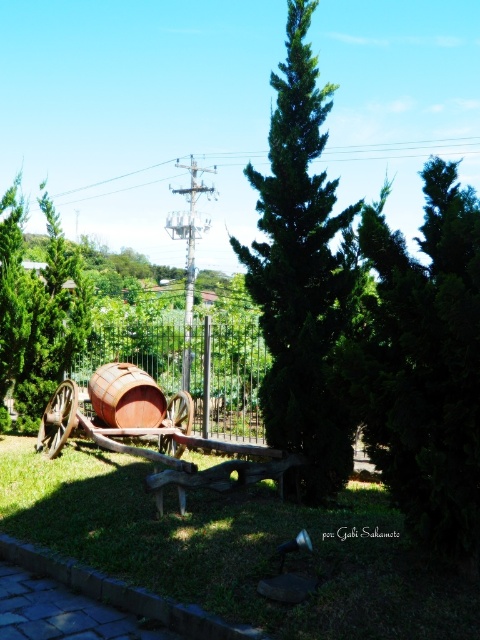
Is dark green textured tree at center above green leafy tree at center?

No.

Does dark green textured tree at center have a smaller size compared to green leafy tree at center?

Yes.

Where is `dark green textured tree at center`? The height and width of the screenshot is (640, 480). dark green textured tree at center is located at coordinates (423, 364).

Is green grass at center bigger than green leafy tree at left?

No.

Who is more distant from viewer, (367, 618) or (9, 301)?

Point (9, 301)

Image resolution: width=480 pixels, height=640 pixels. I want to click on green grass at center, so click(238, 547).

How much distance is there between green leafy tree at left and metallic wire at upper center?

Result: A distance of 5.84 meters exists between green leafy tree at left and metallic wire at upper center.

In the scene shown: Which of these two, green leafy tree at left or metallic wire at upper center, stands taller?

With more height is metallic wire at upper center.

You are a GUI agent. You are given a task and a screenshot of the screen. Output one action in this format:
    pyautogui.click(x=<x>, y=<y>)
    Task: Click on the green leafy tree at left
    The width and height of the screenshot is (480, 640).
    Given the screenshot: What is the action you would take?
    pyautogui.click(x=36, y=310)